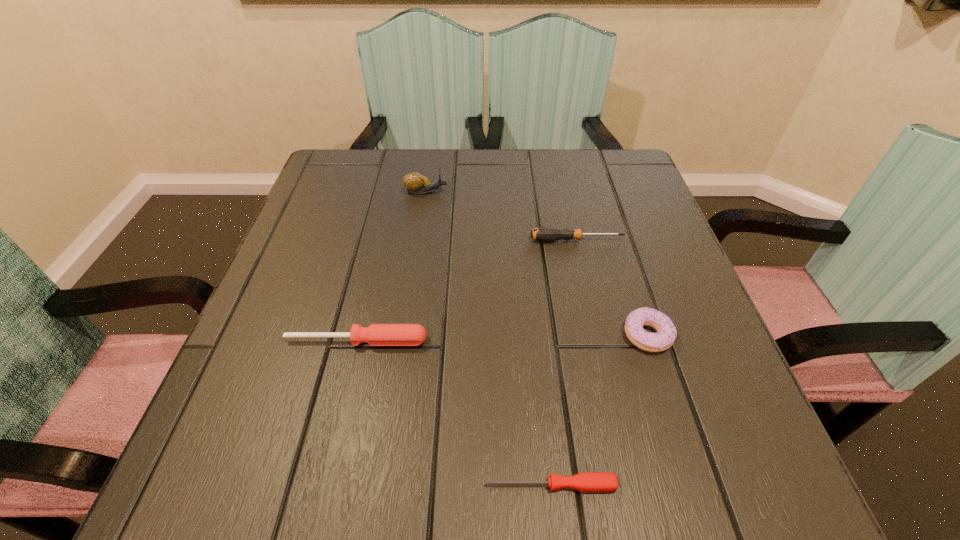
Identify the location of vacant area that lies between the leftmost screwdriver and the second farthest object. (467, 291).

Image resolution: width=960 pixels, height=540 pixels. Identify the location of vacant region between the leftmost screwdriver and the fourth nearest object. (467, 291).

Identify the location of vacant point located between the second nearest screwdriver and the nearest object. (454, 413).

Locate an element on the screen. vacant area that lies between the farthest screwdriver and the doughnut is located at coordinates (612, 288).

Find the location of `free space between the farthest screwdriver and the doughnut`. free space between the farthest screwdriver and the doughnut is located at coordinates (612, 288).

This screenshot has width=960, height=540. I want to click on free space between the shortest screwdriver and the doughnut, so click(599, 410).

Where is `the closest object to the second nearest screwdriver`? The width and height of the screenshot is (960, 540). the closest object to the second nearest screwdriver is located at coordinates (593, 482).

Locate an element on the screen. Image resolution: width=960 pixels, height=540 pixels. object that stands as the closest to the farthest screwdriver is located at coordinates (666, 334).

Locate an element on the screen. The width and height of the screenshot is (960, 540). screwdriver that is the second nearest to the tallest object is located at coordinates (376, 334).

Identify which screwdriver is the closest to the tallest object. Please provide its 2D coordinates. Your answer should be formatted as a tuple, i.e. [(x, y)], where the tuple contains the x and y coordinates of a point satisfying the conditions above.

[(546, 234)]